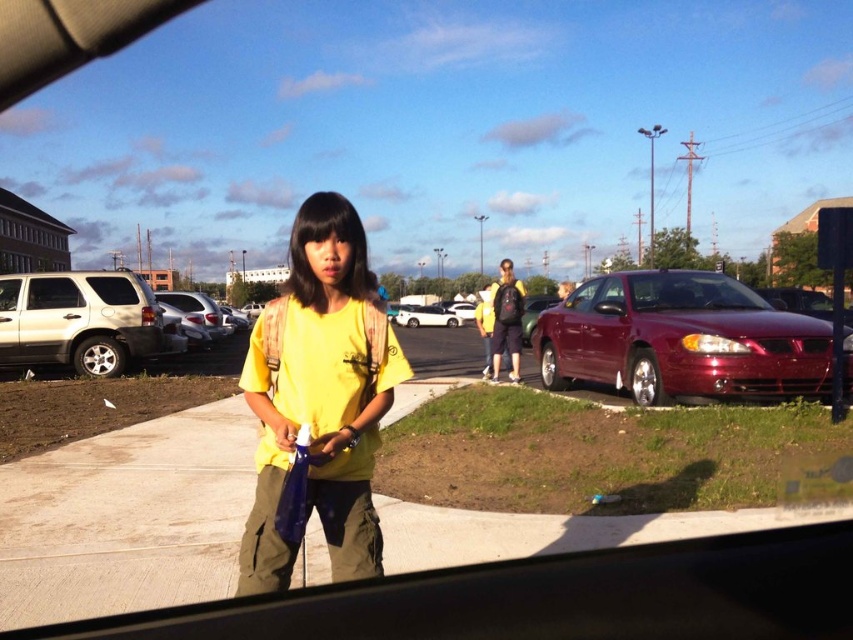
Is yellow matte shirt at center smaller than matte white car window at left?

Actually, yellow matte shirt at center might be larger than matte white car window at left.

Measure the distance between yellow matte shirt at center and matte white car window at left.

9.92 meters

At what (x,y) coordinates should I click in order to perform the action: click on yellow matte shirt at center. Please return your answer as a coordinate pair (x, y). Looking at the image, I should click on (320, 396).

Find the location of `yellow matte shirt at center`. yellow matte shirt at center is located at coordinates (320, 396).

Looking at this image, does matte silver suv at left lie in front of matte white car window at center?

Yes.

The width and height of the screenshot is (853, 640). What do you see at coordinates (80, 321) in the screenshot?
I see `matte silver suv at left` at bounding box center [80, 321].

Who is more forward, (79, 374) or (10, 298)?

Point (10, 298) is more forward.

Find the location of a particular element. This screenshot has height=640, width=853. matte silver suv at left is located at coordinates (80, 321).

Which is more to the right, glossy red car window at center or matte white car window at left?

Positioned to the right is glossy red car window at center.

What do you see at coordinates (689, 291) in the screenshot? I see `glossy red car window at center` at bounding box center [689, 291].

Identify the location of glossy red car window at center. (689, 291).